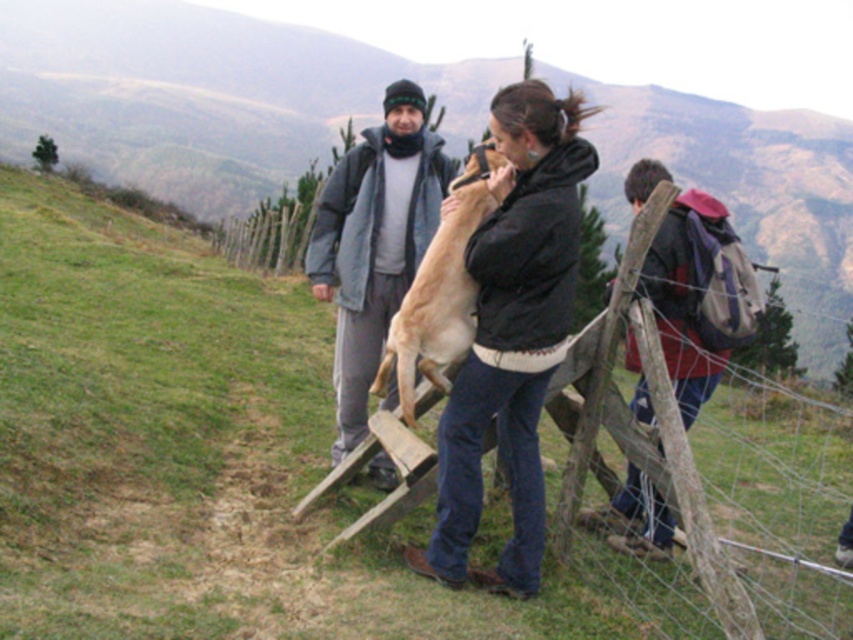
Does wooden fence at center have a lesser width compared to red backpack at right?

Incorrect, wooden fence at center's width is not less than red backpack at right's.

Which of these two, wooden fence at center or red backpack at right, stands taller?

With more height is wooden fence at center.

Which is behind, point (763, 624) or point (641, 269)?

Positioned behind is point (641, 269).

Locate an element on the screen. The width and height of the screenshot is (853, 640). wooden fence at center is located at coordinates (x=779, y=499).

Between point (9, 144) and point (672, 627), which one is positioned behind?

The point (9, 144) is behind.

Find the location of `green grass at lower left`. green grass at lower left is located at coordinates (202, 93).

Based on the photo, between green grass at lower left and black matte jacket at center, which one appears on the left side from the viewer's perspective?

green grass at lower left is more to the left.

Is green grass at lower left closer to camera compared to black matte jacket at center?

That is False.

You are a GUI agent. You are given a task and a screenshot of the screen. Output one action in this format:
    pyautogui.click(x=<x>, y=<y>)
    Task: Click on the green grass at lower left
    This screenshot has height=640, width=853.
    Given the screenshot: What is the action you would take?
    pyautogui.click(x=202, y=93)